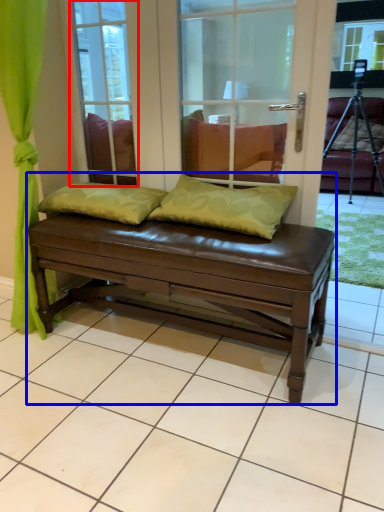
Question: Which of the following is the farthest to the observer, glass door (highlighted by a red box) or studio couch (highlighted by a blue box)?

Choices:
 (A) glass door
 (B) studio couch

Answer: (A)